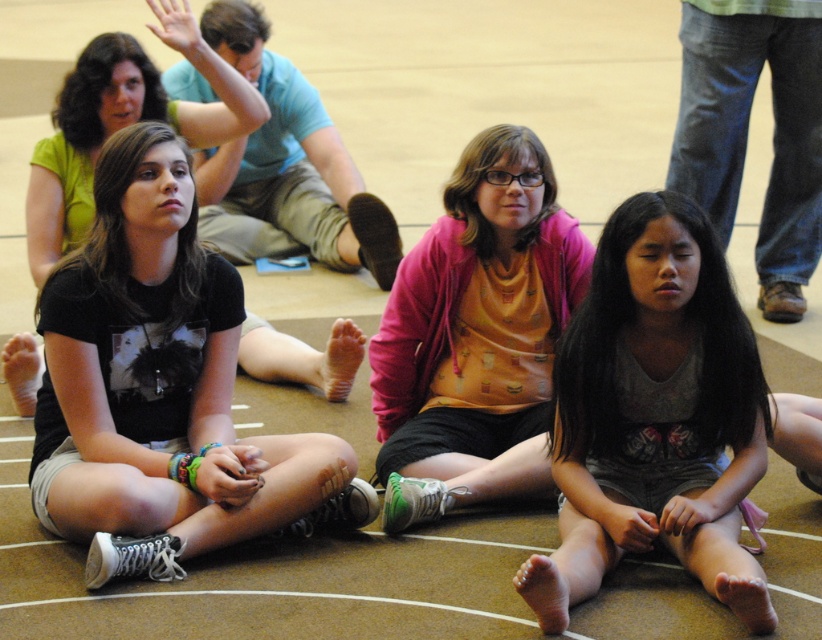
You are standing at the point with coordinates (x=158, y=387) in the gymnasium. Looking around, you see a black fabric shirt at center. Is the point located on the black fabric shirt at center?

Yes, the point with coordinates (x=158, y=387) is located on the black fabric shirt at center.

You are a photographer setting up a camera at the gymnasium floor. You need to capture a photo where both the black fabric shirt at center and the gray cotton shorts at lower right are visible. Considering their heights, which object should be placed closer to the camera to ensure both are in focus?

The black fabric shirt at center is taller than the gray cotton shorts at lower right. To ensure both are in focus, the shorter object, gray cotton shorts at lower right, should be placed closer to the camera.